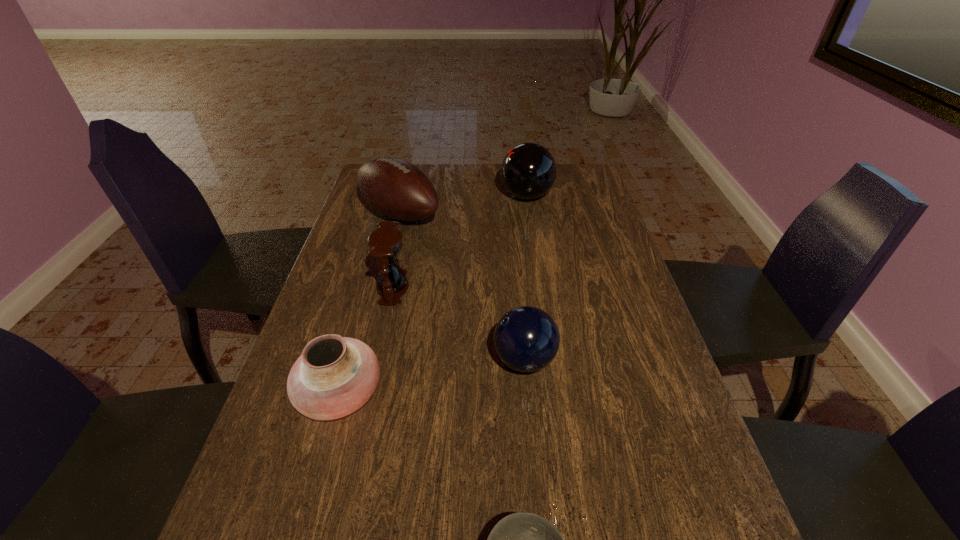
Image resolution: width=960 pixels, height=540 pixels. Identify the location of vacant space situated on the surface of the nearer bowling ball near the finger holes. (397, 360).

Locate an element on the screen. The image size is (960, 540). vacant space located on the surface of the nearer bowling ball near the finger holes is located at coordinates (410, 360).

You are a GUI agent. You are given a task and a screenshot of the screen. Output one action in this format:
    pyautogui.click(x=<x>, y=<y>)
    Task: Click on the free space located on the surface of the nearer bowling ball near the finger holes
    
    Given the screenshot: What is the action you would take?
    pyautogui.click(x=363, y=360)

Where is `vacant space located 0.190m on the front of the pottery`? Image resolution: width=960 pixels, height=540 pixels. vacant space located 0.190m on the front of the pottery is located at coordinates (299, 538).

This screenshot has height=540, width=960. Find the location of `bowling ball that is at the far edge`. bowling ball that is at the far edge is located at coordinates (528, 171).

This screenshot has width=960, height=540. I want to click on football (American) at the far edge, so click(395, 188).

Locate an element on the screen. The width and height of the screenshot is (960, 540). football (American) present at the left edge is located at coordinates (395, 188).

This screenshot has height=540, width=960. I want to click on hourglass located in the left edge section of the desktop, so click(385, 243).

The height and width of the screenshot is (540, 960). I want to click on pottery that is at the left edge, so click(334, 376).

Locate an element on the screen. The height and width of the screenshot is (540, 960). object that is at the far left corner is located at coordinates (395, 188).